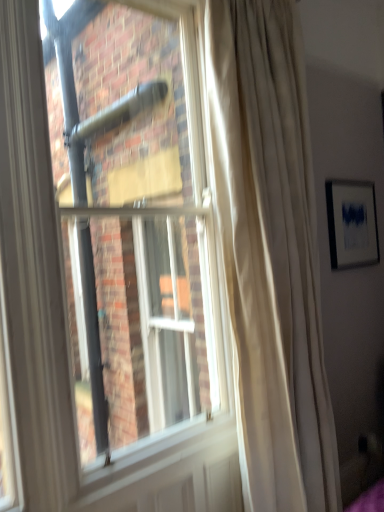
Describe the element at coordinates (352, 223) in the screenshot. I see `matte black picture frame at upper right` at that location.

In order to click on matte black picture frame at upper right in this screenshot , I will do `click(352, 223)`.

At what (x,y) coordinates should I click in order to perform the action: click on matte black picture frame at upper right. Please return your answer as a coordinate pair (x, y). The width and height of the screenshot is (384, 512). Looking at the image, I should click on (352, 223).